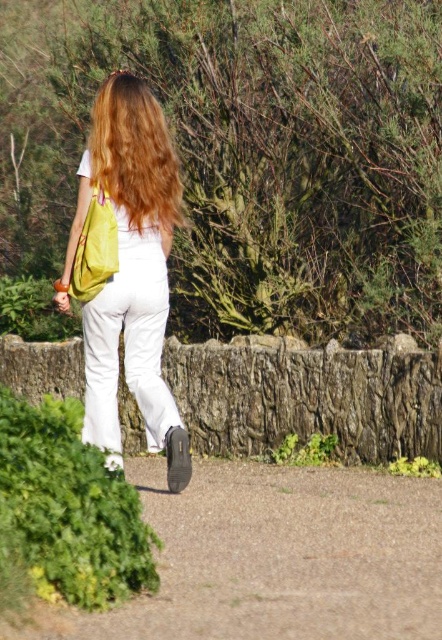
Between point (296, 609) and point (172, 417), which one is positioned behind?

The point (172, 417) is behind.

Which is in front, point (278, 515) or point (88, 170)?

Point (278, 515) is more forward.

Identify the location of gravel at center. The height and width of the screenshot is (640, 442). (275, 557).

Is the position of gravel at center less distant than that of yellow fabric bag at back?

Yes, gravel at center is closer to the viewer.

Find the location of a particular element. The width and height of the screenshot is (442, 640). gravel at center is located at coordinates (275, 557).

Between point (115, 148) and point (90, 230), which one is positioned in front?

Point (90, 230) is more forward.

Does shiny brown hair at upper center have a lesser width compared to yellow fabric bag at back?

Incorrect, shiny brown hair at upper center's width is not less than yellow fabric bag at back's.

Is point (107, 93) farther from camera compared to point (99, 276)?

Yes.

Find the location of a particular element. shiny brown hair at upper center is located at coordinates [134, 154].